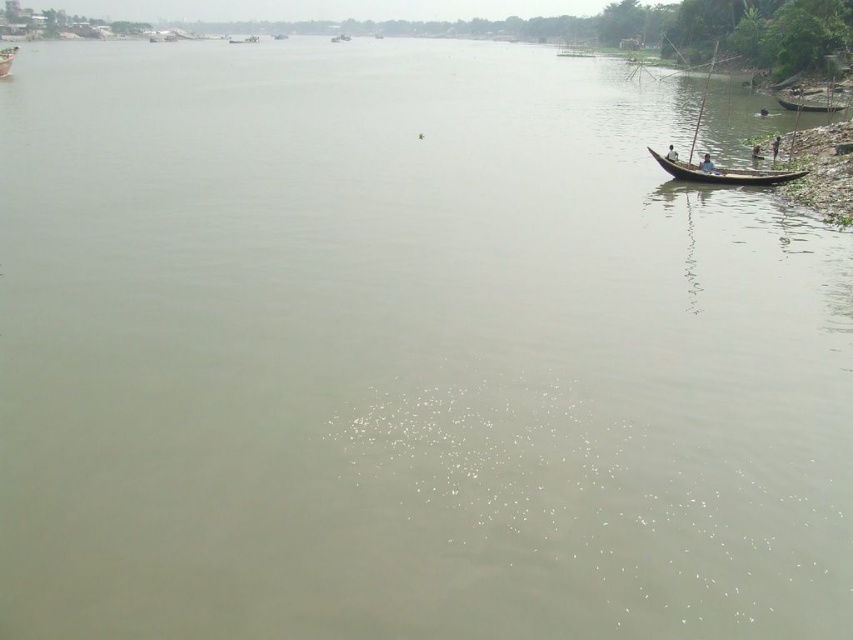
You are a photographer positioned at the center of the river, aiming to capture a photo of the wooden boat at upper left and the wooden paddle at right. Based on their positions, which object should you adjust your camera to focus on first to ensure both are in the frame?

You should focus on the wooden boat at upper left first because the wooden paddle at right is to the right of the wooden boat at upper left, so adjusting the camera to include the boat first ensures the paddle will also be captured in the frame.

You are standing on the rocky shoreline next to the wooden canoe at right and the light blue fabric boat at right. Which boat is closer to the water surface?

The wooden canoe at right is positioned under the light blue fabric boat at right, so the wooden canoe at right is closer to the water surface.